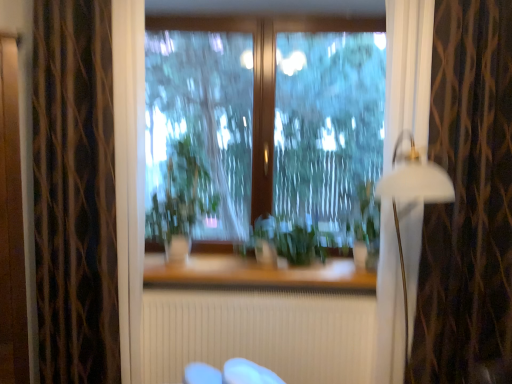
The width and height of the screenshot is (512, 384). What do you see at coordinates (468, 199) in the screenshot? I see `brown textured curtain at right, the 1th curtain when ordered from right to left` at bounding box center [468, 199].

What is the approximate height of white textured radiator at center?

white textured radiator at center is 22.26 inches in height.

The image size is (512, 384). What do you see at coordinates (259, 333) in the screenshot?
I see `white textured radiator at center` at bounding box center [259, 333].

What do you see at coordinates (264, 77) in the screenshot?
I see `transparent glass window at center` at bounding box center [264, 77].

Locate an element on the screen. Image resolution: width=512 pixels, height=384 pixels. brown textured curtain at right, which is the second curtain from left to right is located at coordinates (468, 199).

From a real-world perspective, relative to transparent glass window at center, is green matte plant at center, which is the 1th plant from right to left, vertically above or below?

green matte plant at center, which is the 1th plant from right to left, is situated lower than transparent glass window at center in the real world.

Which object is further away from the camera taking this photo, green matte plant at center, placed as the second plant when sorted from left to right, or transparent glass window at center?

transparent glass window at center is more distant.

Where is `the 2nd plant below when counting from the transparent glass window at center (from the image's perspective)`? The width and height of the screenshot is (512, 384). the 2nd plant below when counting from the transparent glass window at center (from the image's perspective) is located at coordinates (289, 239).

Between green matte plant at center, placed as the second plant when sorted from left to right, and transparent glass window at center, which one has more height?

With more height is transparent glass window at center.

Between transparent glass window at center and green matte plant at center, placed as the second plant when sorted from left to right, which one appears on the left side from the viewer's perspective?

transparent glass window at center is more to the left.

The height and width of the screenshot is (384, 512). Find the location of `window above the green matte plant at center, placed as the second plant when sorted from left to right (from the image's perspective)`. window above the green matte plant at center, placed as the second plant when sorted from left to right (from the image's perspective) is located at coordinates (264, 77).

From a real-world perspective, does transparent glass window at center stand above green matte plant at center, placed as the second plant when sorted from left to right?

Indeed, from a real-world perspective, transparent glass window at center stands above green matte plant at center, placed as the second plant when sorted from left to right.

Measure the distance from transparent glass window at center to green matte plant at center, placed as the second plant when sorted from left to right.

transparent glass window at center and green matte plant at center, placed as the second plant when sorted from left to right, are 43.36 centimeters apart.

In the scene shown: Considering the relative sizes of green leafy plant at center, acting as the first plant starting from the left, and green matte plant at center, placed as the second plant when sorted from left to right, in the image provided, is green leafy plant at center, acting as the first plant starting from the left, taller than green matte plant at center, placed as the second plant when sorted from left to right,?

Yes, green leafy plant at center, acting as the first plant starting from the left, is taller than green matte plant at center, placed as the second plant when sorted from left to right.

Does point (167, 201) come closer to viewer compared to point (290, 241)?

That is False.

Which object is further away from the camera, green leafy plant at center, which is the 2th plant from right to left, or green matte plant at center, which is the 1th plant from right to left?

green leafy plant at center, which is the 2th plant from right to left.

In terms of size, does green leafy plant at center, acting as the first plant starting from the left, appear bigger or smaller than green matte plant at center, placed as the second plant when sorted from left to right?

In the image, green leafy plant at center, acting as the first plant starting from the left, appears to be larger than green matte plant at center, placed as the second plant when sorted from left to right.

From the picture: Who is taller, transparent glass window at center or white textured radiator at center?

transparent glass window at center is taller.

Does point (288, 31) lie behind point (311, 299)?

Yes, point (288, 31) is behind point (311, 299).

Looking at this image, from the image's perspective, is transparent glass window at center located above or below white textured radiator at center?

transparent glass window at center is situated higher than white textured radiator at center in the image.

Is transparent glass window at center oriented away from white textured radiator at center?

No, transparent glass window at center is not facing away from white textured radiator at center.

From the image's perspective, is dark brown textured curtain at left, placed as the 2th curtain when sorted from right to left, below white matte lamp at right?

No.

Does dark brown textured curtain at left, placed as the 2th curtain when sorted from right to left, have a lesser width compared to white matte lamp at right?

Indeed, dark brown textured curtain at left, placed as the 2th curtain when sorted from right to left, has a lesser width compared to white matte lamp at right.

Is dark brown textured curtain at left, placed as the 2th curtain when sorted from right to left, oriented towards white matte lamp at right?

No, dark brown textured curtain at left, placed as the 2th curtain when sorted from right to left, is not oriented towards white matte lamp at right.

From a real-world perspective, is dark brown textured curtain at left, placed as the 2th curtain when sorted from right to left, physically located above or below white matte lamp at right?

From a real-world perspective, dark brown textured curtain at left, placed as the 2th curtain when sorted from right to left, is physically above white matte lamp at right.

What's the angular difference between white matte lamp at right and brown textured curtain at right, the 1th curtain when ordered from right to left,'s facing directions?

The angular difference between white matte lamp at right and brown textured curtain at right, the 1th curtain when ordered from right to left, is 0.000144 degrees.

Considering the relative positions of white matte lamp at right and brown textured curtain at right, the 1th curtain when ordered from right to left, in the image provided, is white matte lamp at right in front of brown textured curtain at right, the 1th curtain when ordered from right to left,?

Yes, it is in front of brown textured curtain at right, the 1th curtain when ordered from right to left.

Can you confirm if white matte lamp at right is wider than brown textured curtain at right, the 1th curtain when ordered from right to left?

Correct, the width of white matte lamp at right exceeds that of brown textured curtain at right, the 1th curtain when ordered from right to left.

Is white matte lamp at right inside or outside of brown textured curtain at right, which is the second curtain from left to right?

The correct answer is: outside.

Between dark brown textured curtain at left, the first curtain from the left, and transparent glass window at center, which one appears on the left side from the viewer's perspective?

dark brown textured curtain at left, the first curtain from the left.

Is dark brown textured curtain at left, placed as the 2th curtain when sorted from right to left, surrounding transparent glass window at center?

Definitely not — transparent glass window at center is not inside dark brown textured curtain at left, placed as the 2th curtain when sorted from right to left.

Is dark brown textured curtain at left, placed as the 2th curtain when sorted from right to left, looking in the opposite direction of transparent glass window at center?

dark brown textured curtain at left, placed as the 2th curtain when sorted from right to left, is not turned away from transparent glass window at center.

Which is in front, point (76, 232) or point (251, 204)?

The point (76, 232) is closer.

You are a GUI agent. You are given a task and a screenshot of the screen. Output one action in this format:
    pyautogui.click(x=<x>, y=<y>)
    Task: Click on the window above the green matte plant at center, which is the 1th plant from right to left (from a real-world perspective)
    This screenshot has width=512, height=384.
    Given the screenshot: What is the action you would take?
    pyautogui.click(x=264, y=77)

Identify the location of window located behind the green matte plant at center, which is the 1th plant from right to left. coord(264,77).

Considering their positions, is white matte lamp at right positioned further to transparent glass window at center than green leafy plant at center, which is the 2th plant from right to left?

white matte lamp at right is further to transparent glass window at center.

Based on the photo, from the image, which object appears to be farther from white textured radiator at center, transparent glass window at center or brown textured curtain at right, the 1th curtain when ordered from right to left?

transparent glass window at center is positioned further to the anchor white textured radiator at center.

Looking at the image, which one is located further to dark brown textured curtain at left, placed as the 2th curtain when sorted from right to left, white textured radiator at center or green matte plant at center, which is the 1th plant from right to left?

green matte plant at center, which is the 1th plant from right to left, is further to dark brown textured curtain at left, placed as the 2th curtain when sorted from right to left.

In the scene shown: From the image, which object appears to be farther from dark brown textured curtain at left, placed as the 2th curtain when sorted from right to left, white textured radiator at center or white matte lamp at right?

white matte lamp at right is further to dark brown textured curtain at left, placed as the 2th curtain when sorted from right to left.

Based on the photo, looking at the image, which one is located further to green matte plant at center, which is the 1th plant from right to left, white textured radiator at center or dark brown textured curtain at left, the first curtain from the left?

The object further to green matte plant at center, which is the 1th plant from right to left, is dark brown textured curtain at left, the first curtain from the left.

Based on their spatial positions, is green matte plant at center, which is the 1th plant from right to left, or brown textured curtain at right, which is the second curtain from left to right, further from green leafy plant at center, which is the 2th plant from right to left?

The object further to green leafy plant at center, which is the 2th plant from right to left, is brown textured curtain at right, which is the second curtain from left to right.

Considering their positions, is transparent glass window at center positioned closer to green leafy plant at center, acting as the first plant starting from the left, than dark brown textured curtain at left, the first curtain from the left?

Based on the image, transparent glass window at center appears to be nearer to green leafy plant at center, acting as the first plant starting from the left.

Considering their positions, is brown textured curtain at right, which is the second curtain from left to right, positioned closer to white matte lamp at right than transparent glass window at center?

brown textured curtain at right, which is the second curtain from left to right.

What are the coordinates of `window situated between dark brown textured curtain at left, the first curtain from the left, and brown textured curtain at right, the 1th curtain when ordered from right to left, from left to right` in the screenshot? It's located at (264, 77).

Find the location of a particular element. The width and height of the screenshot is (512, 384). window between dark brown textured curtain at left, placed as the 2th curtain when sorted from right to left, and green matte plant at center, which is the 1th plant from right to left is located at coordinates (264, 77).

Image resolution: width=512 pixels, height=384 pixels. In order to click on radiator situated between green leafy plant at center, which is the 2th plant from right to left, and brown textured curtain at right, which is the second curtain from left to right, from left to right in this screenshot , I will do `click(259, 333)`.

Where is `plant situated between dark brown textured curtain at left, the first curtain from the left, and transparent glass window at center from left to right`? plant situated between dark brown textured curtain at left, the first curtain from the left, and transparent glass window at center from left to right is located at coordinates (181, 195).